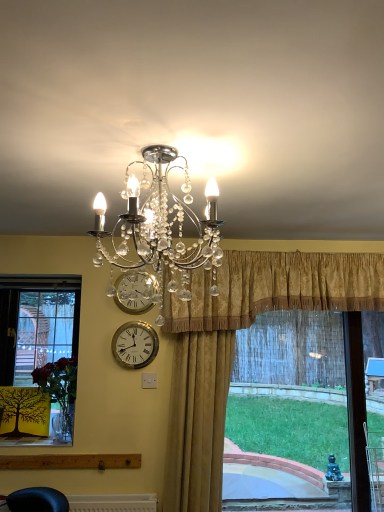
Question: Does gold velvet curtain at center, which appears as the first curtain when viewed from the left, appear on the right side of clear crystal chandelier at upper center?

Choices:
 (A) yes
 (B) no

Answer: (A)

Question: Can you confirm if gold velvet curtain at center, the second curtain positioned from the right, is wider than clear crystal chandelier at upper center?

Choices:
 (A) no
 (B) yes

Answer: (A)

Question: Can you confirm if gold velvet curtain at center, the second curtain positioned from the right, is smaller than clear crystal chandelier at upper center?

Choices:
 (A) yes
 (B) no

Answer: (B)

Question: Considering the relative sizes of gold velvet curtain at center, which appears as the first curtain when viewed from the left, and clear crystal chandelier at upper center in the image provided, is gold velvet curtain at center, which appears as the first curtain when viewed from the left, shorter than clear crystal chandelier at upper center?

Choices:
 (A) yes
 (B) no

Answer: (B)

Question: Does gold velvet curtain at center, which appears as the first curtain when viewed from the left, have a greater height compared to clear crystal chandelier at upper center?

Choices:
 (A) no
 (B) yes

Answer: (B)

Question: In terms of width, does clear crystal chandelier at upper center look wider or thinner when compared to gold metallic clock at upper center?

Choices:
 (A) thin
 (B) wide

Answer: (B)

Question: Looking at the image, does clear crystal chandelier at upper center seem bigger or smaller compared to gold metallic clock at upper center?

Choices:
 (A) big
 (B) small

Answer: (A)

Question: In the image, is clear crystal chandelier at upper center on the left side or the right side of gold metallic clock at upper center?

Choices:
 (A) right
 (B) left

Answer: (A)

Question: In terms of height, does clear crystal chandelier at upper center look taller or shorter compared to gold metallic clock at upper center?

Choices:
 (A) tall
 (B) short

Answer: (A)

Question: Is gold metallic clock at upper center inside the boundaries of gold damask curtain at center, which is counted as the second curtain, starting from the left, or outside?

Choices:
 (A) outside
 (B) inside

Answer: (A)

Question: In the image, is gold metallic clock at upper center positioned in front of or behind gold damask curtain at center, placed as the first curtain when sorted from right to left?

Choices:
 (A) front
 (B) behind

Answer: (B)

Question: Considering the positions of gold metallic clock at upper center and gold damask curtain at center, which is counted as the second curtain, starting from the left, in the image, is gold metallic clock at upper center wider or thinner than gold damask curtain at center, which is counted as the second curtain, starting from the left,?

Choices:
 (A) wide
 (B) thin

Answer: (B)

Question: Considering the relative positions of gold metallic clock at upper center and gold damask curtain at center, which is counted as the second curtain, starting from the left, in the image provided, is gold metallic clock at upper center to the left or to the right of gold damask curtain at center, which is counted as the second curtain, starting from the left,?

Choices:
 (A) right
 (B) left

Answer: (B)

Question: Considering their positions, is gold metallic clock at upper center located in front of or behind gold velvet curtain at center, the second curtain positioned from the right?

Choices:
 (A) front
 (B) behind

Answer: (B)

Question: In terms of height, does gold metallic clock at upper center look taller or shorter compared to gold velvet curtain at center, which appears as the first curtain when viewed from the left?

Choices:
 (A) tall
 (B) short

Answer: (B)